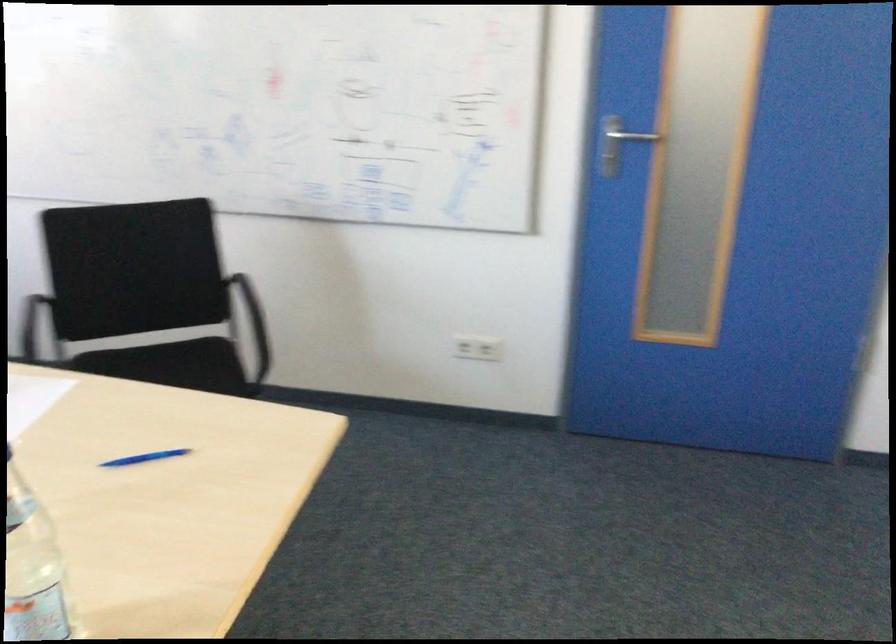
At what (x,y) coordinates should I click in order to perform the action: click on silver door handle. Please return your answer as a coordinate pair (x, y). The height and width of the screenshot is (644, 896). Looking at the image, I should click on (616, 144).